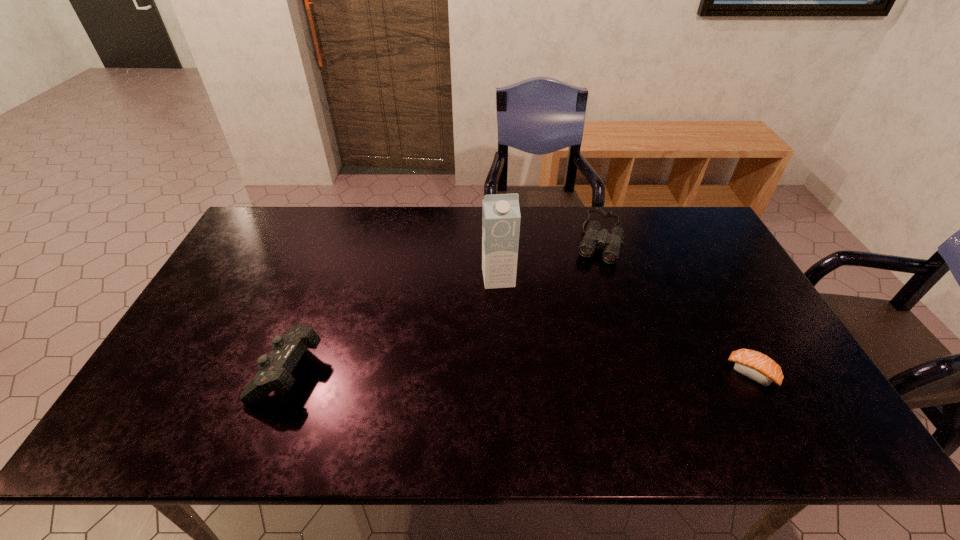
Identify the location of the second tallest object. (275, 369).

At what (x,y) coordinates should I click in order to perform the action: click on control. Please return your answer as a coordinate pair (x, y). The height and width of the screenshot is (540, 960). Looking at the image, I should click on (275, 369).

Find the location of `the rightmost object`. the rightmost object is located at coordinates (752, 364).

In order to click on sushi in this screenshot , I will do `click(752, 364)`.

Find the location of `the third nearest object`. the third nearest object is located at coordinates (501, 216).

Where is `the second object from left to right`? This screenshot has height=540, width=960. the second object from left to right is located at coordinates (501, 216).

At what (x,y) coordinates should I click in order to perform the action: click on the second object from right to left. Please return your answer as a coordinate pair (x, y). Image resolution: width=960 pixels, height=540 pixels. Looking at the image, I should click on (593, 236).

Image resolution: width=960 pixels, height=540 pixels. I want to click on the farthest object, so click(593, 236).

Locate an element on the screen. vacant space located on the back of the control is located at coordinates (329, 264).

Identify the location of vacant position located on the back of the rightmost object. (694, 265).